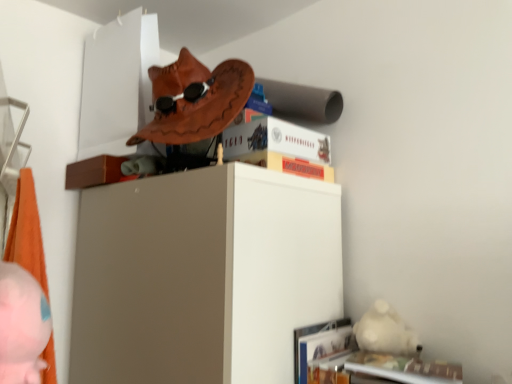
Question: Is monopoly board game at upper center, which ranks as the 2th paperback book in top-to-bottom order, to the left or to the right of hardcover book at upper center, which ranks as the 2th paperback book in bottom-to-top order, in the image?

Choices:
 (A) left
 (B) right

Answer: (B)

Question: Is monopoly board game at upper center, the 1th paperback book in the bottom-to-top sequence, wider or thinner than hardcover book at upper center, the 1th paperback book positioned from the top?

Choices:
 (A) thin
 (B) wide

Answer: (B)

Question: Which object is positioned closest to the hardcover book at upper center, the 1th paperback book positioned from the top?

Choices:
 (A) pink plush toy at lower left
 (B) monopoly board game at upper center, which ranks as the 2th paperback book in top-to-bottom order

Answer: (B)

Question: Estimate the real-world distances between objects in this image. Which object is farther from the monopoly board game at upper center, which ranks as the 2th paperback book in top-to-bottom order?

Choices:
 (A) hardcover book at upper center, the 1th paperback book positioned from the top
 (B) pink plush toy at lower left

Answer: (B)